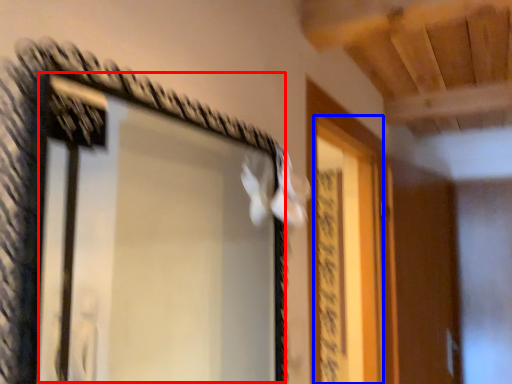
Question: Among these objects, which one is nearest to the camera, window (highlighted by a red box) or screen door (highlighted by a blue box)?

Choices:
 (A) window
 (B) screen door

Answer: (A)